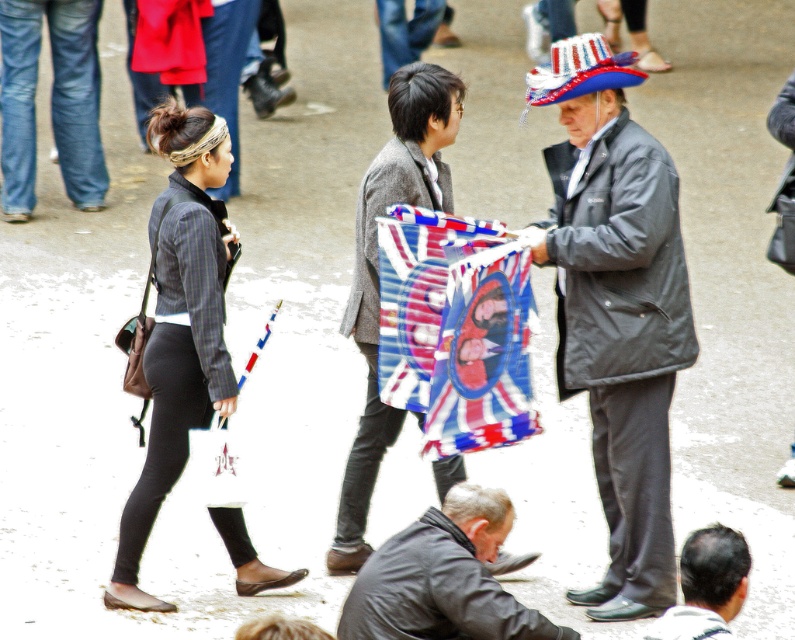
Question: Which object is the farthest from the dark brown leather jacket at lower right?

Choices:
 (A) polyester flag at center
 (B) dark gray jacket at lower center
 (C) textured gray coat at center
 (D) gray fabric hat at right

Answer: (C)

Question: Does polyester flag at center lie in front of textured gray coat at center?

Choices:
 (A) no
 (B) yes

Answer: (B)

Question: Is gray fabric hat at right positioned at the back of textured gray coat at center?

Choices:
 (A) yes
 (B) no

Answer: (B)

Question: Which of the following is the farthest from the observer?

Choices:
 (A) dark brown leather jacket at lower right
 (B) textured gray coat at center
 (C) gray fabric hat at right
 (D) polyester flag at center

Answer: (B)

Question: Is matte black leggings at center wider than textured gray coat at center?

Choices:
 (A) no
 (B) yes

Answer: (A)

Question: Among these points, which one is nearest to the camera?

Choices:
 (A) (450, 380)
 (B) (417, 532)
 (C) (371, 424)

Answer: (B)